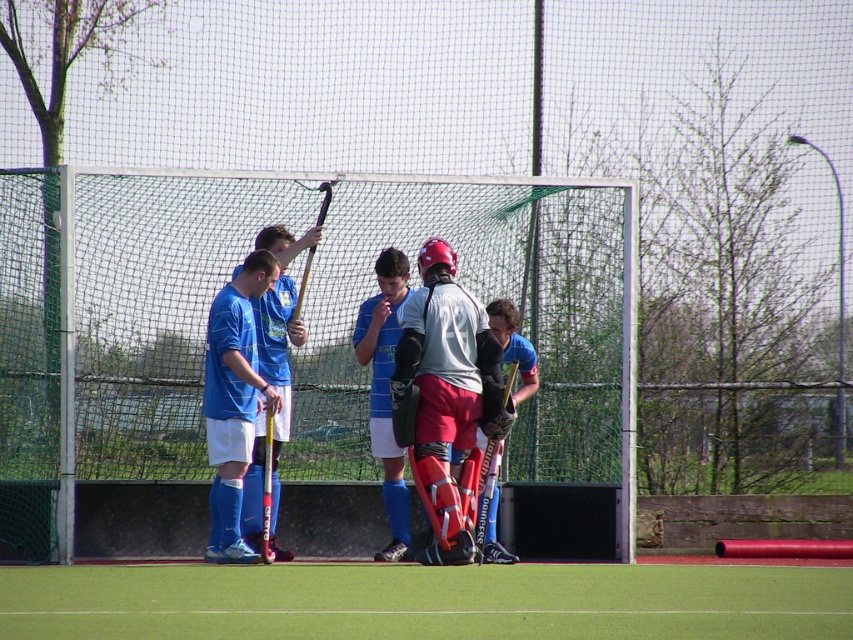
You are a photographer trying to capture a closeup of the matte black hockey stick at center without including the matte gray jersey at center in the frame. Given their sizes, is this possible?

The matte gray jersey at center is bigger than the matte black hockey stick at center, so it might be challenging to exclude the jersey entirely due to its larger size unless you adjust your camera angle or position to focus solely on the smaller hockey stick.

You are a field hockey coach observing the practice session. You notice the matte gray jersey at center and the matte black hockey stick at center. Which object is taller?

The matte gray jersey at center is much taller than the matte black hockey stick at center.